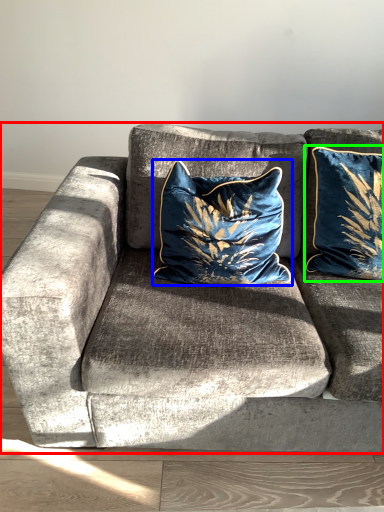
Question: Which object is the farthest from studio couch (highlighted by a red box)? Choose among these: pillow (highlighted by a blue box) or pillow (highlighted by a green box).

Choices:
 (A) pillow
 (B) pillow

Answer: (B)